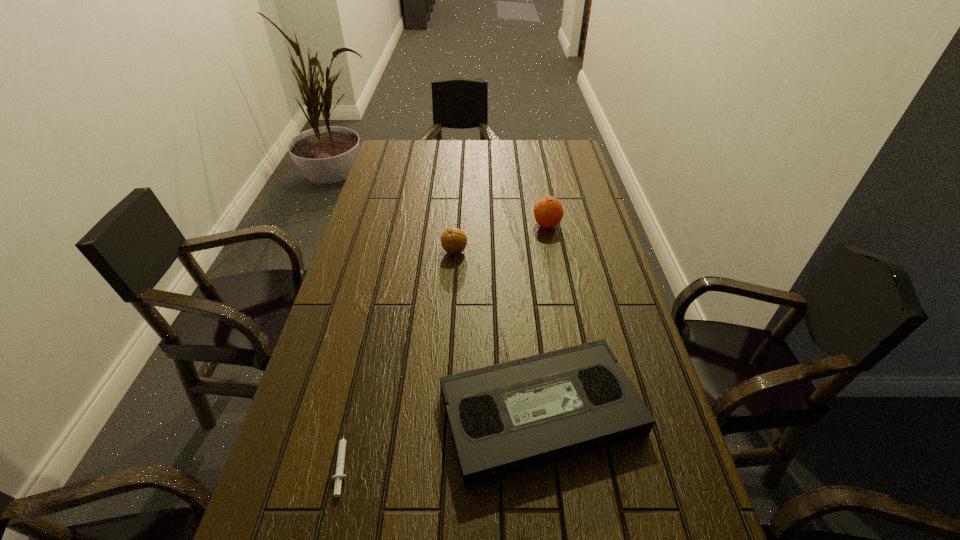
Identify the location of empty space between the farther orange and the leftmost object. This screenshot has height=540, width=960. (445, 342).

Locate an element on the screen. This screenshot has height=540, width=960. blank region between the videotape and the second tallest object is located at coordinates (497, 332).

Locate an element on the screen. unoccupied position between the nearer orange and the syringe is located at coordinates (399, 355).

The height and width of the screenshot is (540, 960). I want to click on blank region between the farther orange and the third nearest object, so click(x=501, y=238).

Identify the location of free spot between the videotape and the right orange. (544, 319).

The height and width of the screenshot is (540, 960). I want to click on free spot between the nearer orange and the second shortest object, so click(497, 332).

In order to click on vacant space in between the third nearest object and the videotape in this screenshot , I will do `click(497, 332)`.

I want to click on object that is the second closest to the leftmost object, so click(453, 240).

This screenshot has width=960, height=540. Find the location of `object that is the closest to the second tallest object`. object that is the closest to the second tallest object is located at coordinates (548, 211).

This screenshot has width=960, height=540. I want to click on free spot that satisfies the following two spatial constraints: 1. on the front side of the videotape; 2. on the right side of the nearer orange, so click(444, 412).